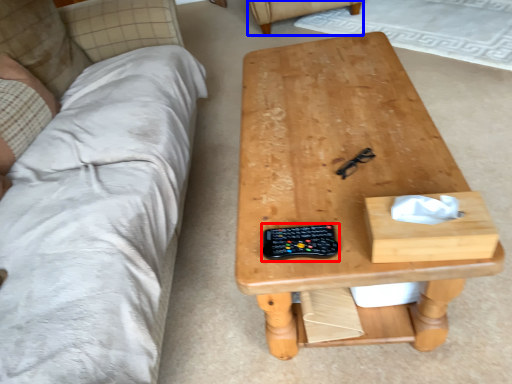
Question: Among these objects, which one is farthest to the camera, control (highlighted by a red box) or armchair (highlighted by a blue box)?

Choices:
 (A) control
 (B) armchair

Answer: (B)